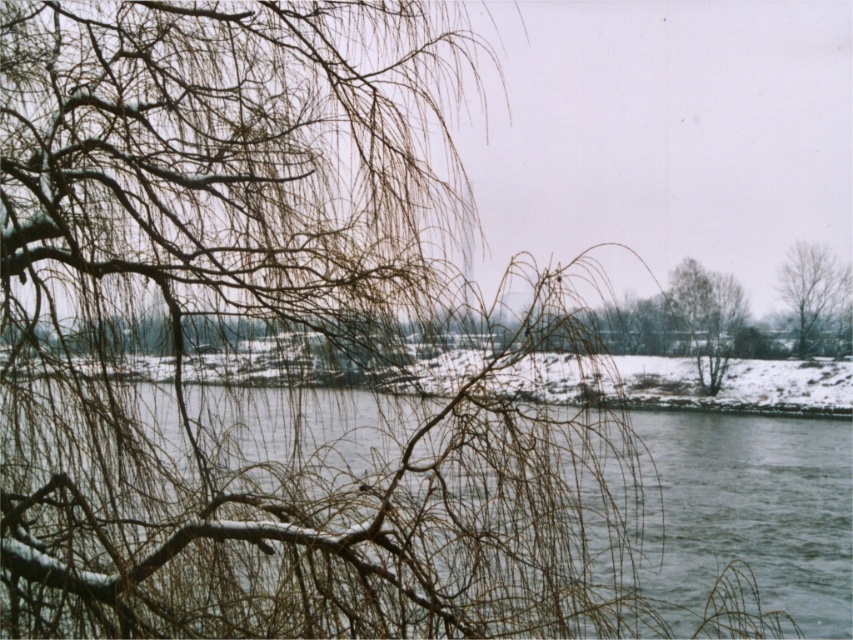
Based on the photo, does smooth gray water at center have a greater width compared to green leafy tree at center?

Yes.

Is smooth gray water at center shorter than green leafy tree at center?

No.

Describe the element at coordinates (399, 513) in the screenshot. I see `smooth gray water at center` at that location.

Locate an element on the screen. smooth gray water at center is located at coordinates (399, 513).

Does green leafy tree at center have a smaller size compared to bare branches at right?

No, green leafy tree at center is not smaller than bare branches at right.

Who is positioned more to the left, green leafy tree at center or bare branches at right?

Positioned to the left is green leafy tree at center.

Which is behind, point (715, 314) or point (778, 276)?

The point (778, 276) is behind.

Image resolution: width=853 pixels, height=640 pixels. I want to click on green leafy tree at center, so click(706, 317).

Does smooth gray water at center appear on the right side of bare branches at right?

Incorrect, smooth gray water at center is not on the right side of bare branches at right.

Locate an element on the screen. smooth gray water at center is located at coordinates (399, 513).

At what (x,y) coordinates should I click in order to perform the action: click on smooth gray water at center. Please return your answer as a coordinate pair (x, y). The image size is (853, 640). Looking at the image, I should click on (399, 513).